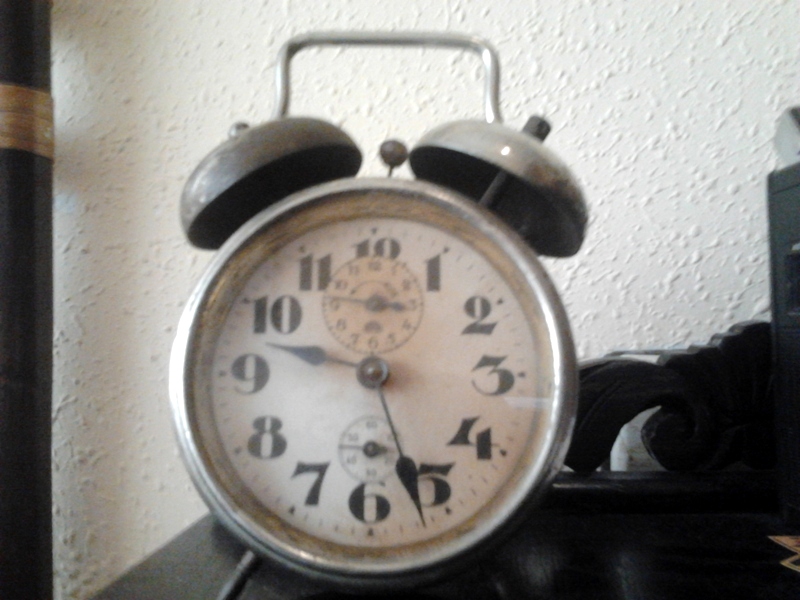
This screenshot has width=800, height=600. What are the coordinates of `smaller clock within clock` in the screenshot? It's located at (398, 328).